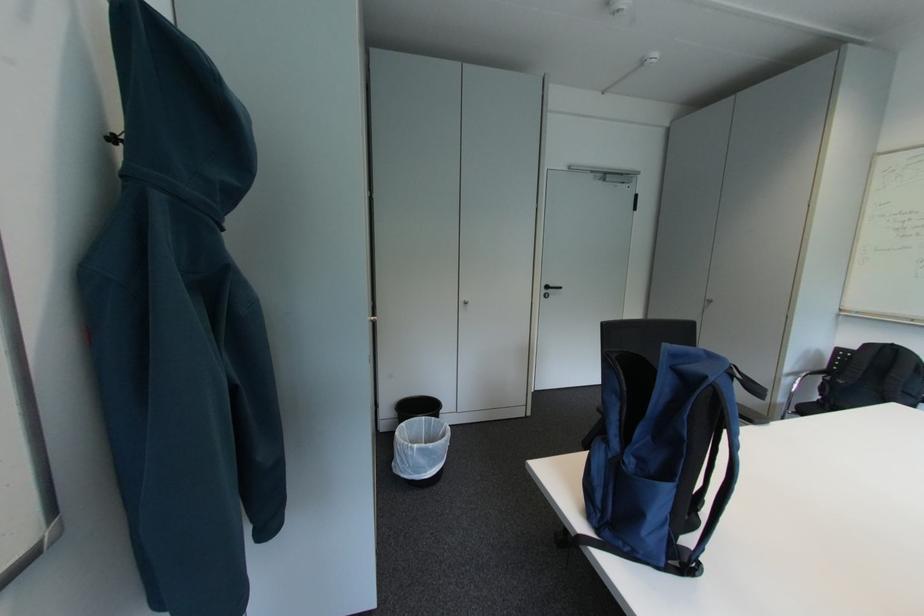
Describe the element at coordinates (115, 138) in the screenshot. The height and width of the screenshot is (616, 924). I see `the hoodie cord toggle` at that location.